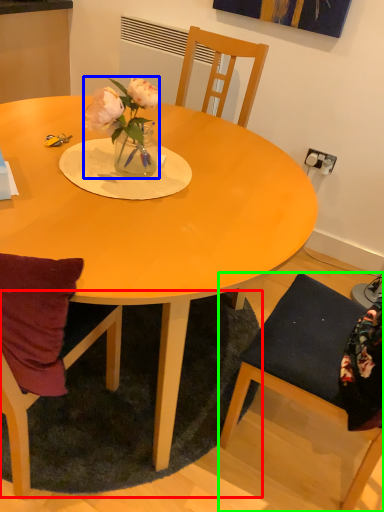
Question: Considering the real-world distances, which object is closest to mat (highlighted by a red box)? houseplant (highlighted by a blue box) or chair (highlighted by a green box).

Choices:
 (A) houseplant
 (B) chair

Answer: (B)